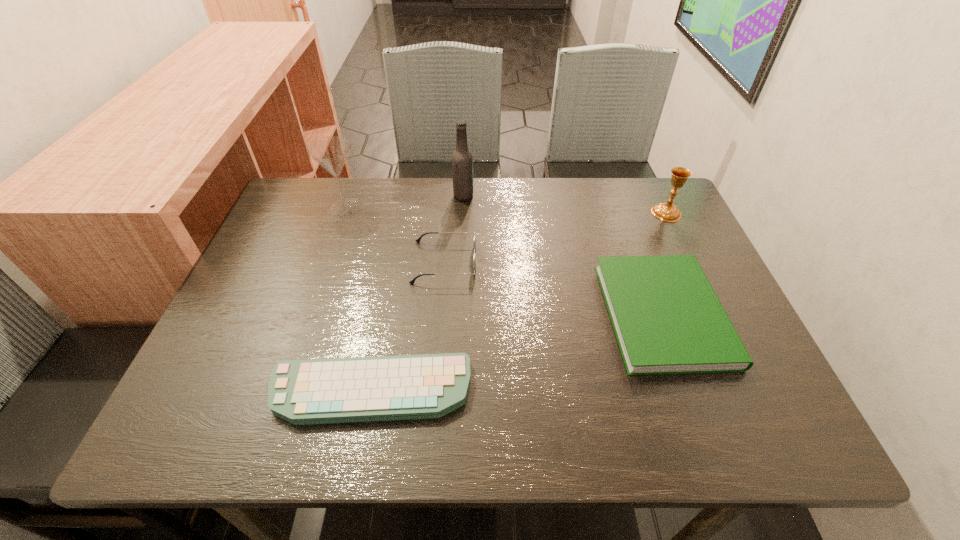
Locate an element on the screen. The width and height of the screenshot is (960, 540). object at the far left corner is located at coordinates (331, 152).

In order to click on object situated at the near left corner in this screenshot , I will do `click(339, 390)`.

Image resolution: width=960 pixels, height=540 pixels. In order to click on object at the far right corner in this screenshot , I will do `click(669, 212)`.

Image resolution: width=960 pixels, height=540 pixels. What are the coordinates of `vacant space at the far edge of the desktop` in the screenshot? It's located at (372, 210).

The image size is (960, 540). What are the coordinates of `free region at the near edge` in the screenshot? It's located at [660, 440].

At what (x,y) coordinates should I click in order to perform the action: click on free location at the left edge. Please return your answer as a coordinate pair (x, y). Looking at the image, I should click on pos(301,239).

This screenshot has height=540, width=960. In order to click on vacant space at the far left corner of the desktop in this screenshot , I will do `click(311, 200)`.

At what (x,y) coordinates should I click in order to perform the action: click on vacant space at the near left corner. Please return your answer as a coordinate pair (x, y). Image resolution: width=960 pixels, height=540 pixels. Looking at the image, I should click on pos(228,429).

Where is `vacant position at the far right corner of the desktop`? The height and width of the screenshot is (540, 960). vacant position at the far right corner of the desktop is located at coordinates coord(620,187).

This screenshot has width=960, height=540. Identify the location of unoccupied position between the beer bottle and the shortest object. (418, 293).